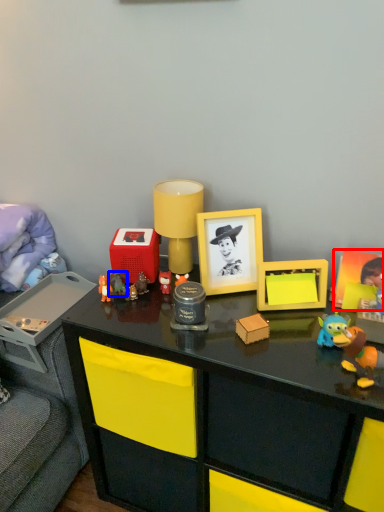
Question: Which object is further to the camera taking this photo, picture frame (highlighted by a red box) or toy (highlighted by a blue box)?

Choices:
 (A) picture frame
 (B) toy

Answer: (B)